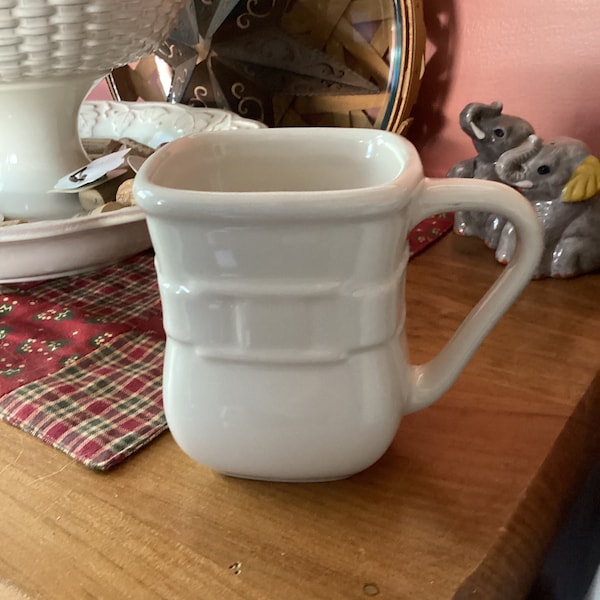
Identify the location of cup handle. This screenshot has width=600, height=600. 443,191.